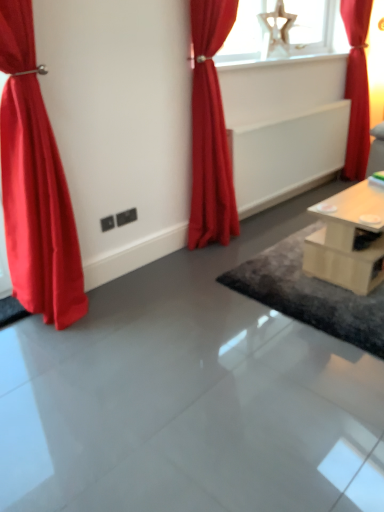
Image resolution: width=384 pixels, height=512 pixels. Describe the element at coordinates (357, 87) in the screenshot. I see `red velvet curtain at upper right, which is the 1th curtain from back to front` at that location.

Identify the location of matte red curtain at left, arranged as the first curtain when viewed from the front. (35, 184).

Which object is closer to the camera, white glossy radiator at upper center or matte red curtain at left, which ranks as the third curtain in right-to-left order?

Positioned in front is matte red curtain at left, which ranks as the third curtain in right-to-left order.

Can you tell me how much white glossy radiator at upper center and matte red curtain at left, marked as the first curtain in a left-to-right arrangement, differ in facing direction?

2.26 degrees separate the facing orientations of white glossy radiator at upper center and matte red curtain at left, marked as the first curtain in a left-to-right arrangement.

Which of these two, white glossy radiator at upper center or matte red curtain at left, which ranks as the third curtain in right-to-left order, is thinner?

With smaller width is white glossy radiator at upper center.

Which point is more distant from viewer, (x=286, y=57) or (x=16, y=241)?

The point (x=286, y=57) is farther from the camera.

Between matte red curtain at center, the 2th curtain from the right, and matte red curtain at left, arranged as the first curtain when viewed from the front, which one appears on the right side from the viewer's perspective?

Positioned to the right is matte red curtain at center, the 2th curtain from the right.

Consider the image. From the image's perspective, which object appears higher, matte red curtain at center, the 2th curtain from the right, or matte red curtain at left, acting as the 3th curtain starting from the back?

matte red curtain at center, the 2th curtain from the right, is shown above in the image.

Is matte red curtain at center, the 2th curtain from the right, not near matte red curtain at left, marked as the first curtain in a left-to-right arrangement?

Indeed, matte red curtain at center, the 2th curtain from the right, is not near matte red curtain at left, marked as the first curtain in a left-to-right arrangement.

From a real-world perspective, is matte red curtain at center, acting as the second curtain starting from the front, physically below white glossy radiator at upper center?

Correct, in the physical world, matte red curtain at center, acting as the second curtain starting from the front, is lower than white glossy radiator at upper center.

Where is `window sill above the matte red curtain at center, the 2th curtain from the right (from a real-world perspective)`? Image resolution: width=384 pixels, height=512 pixels. window sill above the matte red curtain at center, the 2th curtain from the right (from a real-world perspective) is located at coordinates (274, 61).

Who is smaller, matte red curtain at center, acting as the second curtain starting from the front, or white glossy radiator at upper center?

white glossy radiator at upper center is smaller.

Considering the points (214, 239) and (297, 61), which point is behind, point (214, 239) or point (297, 61)?

The point (297, 61) is farther from the camera.

From a real-world perspective, which curtain is the 3rd one above the dark gray textured rug at center? Please provide its 2D coordinates.

[(357, 87)]

From the image's perspective, is dark gray textured rug at center beneath red velvet curtain at upper right, marked as the third curtain in a front-to-back arrangement?

Correct, dark gray textured rug at center appears lower than red velvet curtain at upper right, marked as the third curtain in a front-to-back arrangement, in the image.

Is dark gray textured rug at center far from red velvet curtain at upper right, which is the 1th curtain from back to front?

Yes, dark gray textured rug at center and red velvet curtain at upper right, which is the 1th curtain from back to front, are quite far apart.

Is dark gray textured rug at center oriented away from red velvet curtain at upper right, which appears as the first curtain when viewed from the right?

No.

Between light wood table at right and red velvet curtain at upper right, which is the 1th curtain from back to front, which one has larger width?

Wider between the two is light wood table at right.

From the picture: Is light wood table at right not near red velvet curtain at upper right, marked as the third curtain in a front-to-back arrangement?

Absolutely, light wood table at right is distant from red velvet curtain at upper right, marked as the third curtain in a front-to-back arrangement.

From the image's perspective, which is below, light wood table at right or red velvet curtain at upper right, which is the 1th curtain from back to front?

From the image's view, light wood table at right is below.

From the image's perspective, is light wood table at right beneath matte red curtain at center, acting as the second curtain starting from the front?

Correct, light wood table at right appears lower than matte red curtain at center, acting as the second curtain starting from the front, in the image.

In order to click on table below the matte red curtain at center, which is the 2th curtain from back to front (from the image's perspective) in this screenshot , I will do `click(347, 240)`.

Can you confirm if light wood table at right is bigger than matte red curtain at center, acting as the second curtain starting from the front?

No, light wood table at right is not bigger than matte red curtain at center, acting as the second curtain starting from the front.

From the image's perspective, is white glossy radiator at upper center located beneath dark gray textured rug at center?

No, from the image's perspective, white glossy radiator at upper center is not below dark gray textured rug at center.

Is white glossy radiator at upper center taller than dark gray textured rug at center?

Yes, white glossy radiator at upper center is taller than dark gray textured rug at center.

From a real-world perspective, which is physically below, white glossy radiator at upper center or dark gray textured rug at center?

dark gray textured rug at center is physically lower.

Does white glossy radiator at upper center have a greater width compared to dark gray textured rug at center?

No, white glossy radiator at upper center is not wider than dark gray textured rug at center.

At what (x,y) coordinates should I click in order to perform the action: click on the 3rd curtain positioned below the white glossy radiator at upper center (from a real-world perspective). Please return your answer as a coordinate pair (x, y). The width and height of the screenshot is (384, 512). Looking at the image, I should click on (35, 184).

The width and height of the screenshot is (384, 512). I want to click on the 1st curtain to the right when counting from the matte red curtain at left, acting as the 3th curtain starting from the back, so click(x=210, y=130).

Based on the photo, estimate the real-world distances between objects in this image. Which object is further from dark gray textured rug at center, light wood table at right or red velvet curtain at upper right, marked as the third curtain in a front-to-back arrangement?

red velvet curtain at upper right, marked as the third curtain in a front-to-back arrangement.

Looking at this image, looking at the image, which one is located closer to red velvet curtain at upper right, marked as the third curtain in a front-to-back arrangement, matte red curtain at left, marked as the first curtain in a left-to-right arrangement, or white glossy radiator at upper center?

white glossy radiator at upper center lies closer to red velvet curtain at upper right, marked as the third curtain in a front-to-back arrangement, than the other object.

From the image, which object appears to be nearer to light wood table at right, dark gray textured rug at center or matte red curtain at left, which ranks as the third curtain in right-to-left order?

dark gray textured rug at center.

Which object lies nearer to the anchor point matte red curtain at left, which ranks as the third curtain in right-to-left order, light wood table at right or white glossy radiator at upper center?

Based on the image, light wood table at right appears to be nearer to matte red curtain at left, which ranks as the third curtain in right-to-left order.

Looking at the image, which one is located closer to white glossy radiator at upper center, matte red curtain at center, which is the 2th curtain from back to front, or dark gray textured rug at center?

The object closer to white glossy radiator at upper center is matte red curtain at center, which is the 2th curtain from back to front.

When comparing their distances from light wood table at right, does matte red curtain at left, marked as the first curtain in a left-to-right arrangement, or matte red curtain at center, which is the 2th curtain from back to front, seem further?

matte red curtain at left, marked as the first curtain in a left-to-right arrangement, lies further to light wood table at right than the other object.

When comparing their distances from red velvet curtain at upper right, marked as the third curtain in a front-to-back arrangement, does light wood table at right or dark gray textured rug at center seem further?

dark gray textured rug at center is further to red velvet curtain at upper right, marked as the third curtain in a front-to-back arrangement.

Looking at the image, which one is located further to dark gray textured rug at center, matte red curtain at left, acting as the 3th curtain starting from the back, or light wood table at right?

Among the two, matte red curtain at left, acting as the 3th curtain starting from the back, is located further to dark gray textured rug at center.

Locate an element on the screen. table located between matte red curtain at left, marked as the first curtain in a left-to-right arrangement, and red velvet curtain at upper right, which appears as the first curtain when viewed from the right, in the left-right direction is located at coordinates (347, 240).

You are a GUI agent. You are given a task and a screenshot of the screen. Output one action in this format:
    pyautogui.click(x=<x>, y=<y>)
    Task: Click on the table that lies between white glossy radiator at upper center and dark gray textured rug at center from top to bottom
    The image size is (384, 512).
    Given the screenshot: What is the action you would take?
    pyautogui.click(x=347, y=240)

Locate an element on the screen. This screenshot has width=384, height=512. table situated between matte red curtain at center, the 2th curtain from the right, and red velvet curtain at upper right, which appears as the first curtain when viewed from the right, from left to right is located at coordinates (347, 240).

You are a GUI agent. You are given a task and a screenshot of the screen. Output one action in this format:
    pyautogui.click(x=<x>, y=<y>)
    Task: Click on the window sill located between matte red curtain at left, marked as the first curtain in a left-to-right arrangement, and light wood table at right in the left-right direction
    This screenshot has height=512, width=384.
    Given the screenshot: What is the action you would take?
    pyautogui.click(x=274, y=61)